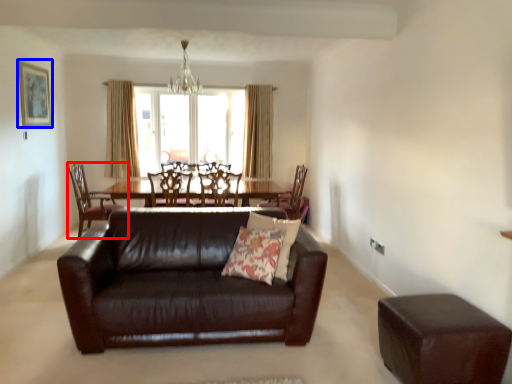
Question: Which point is further to the camera, chair (highlighted by a red box) or picture frame (highlighted by a blue box)?

Choices:
 (A) chair
 (B) picture frame

Answer: (A)